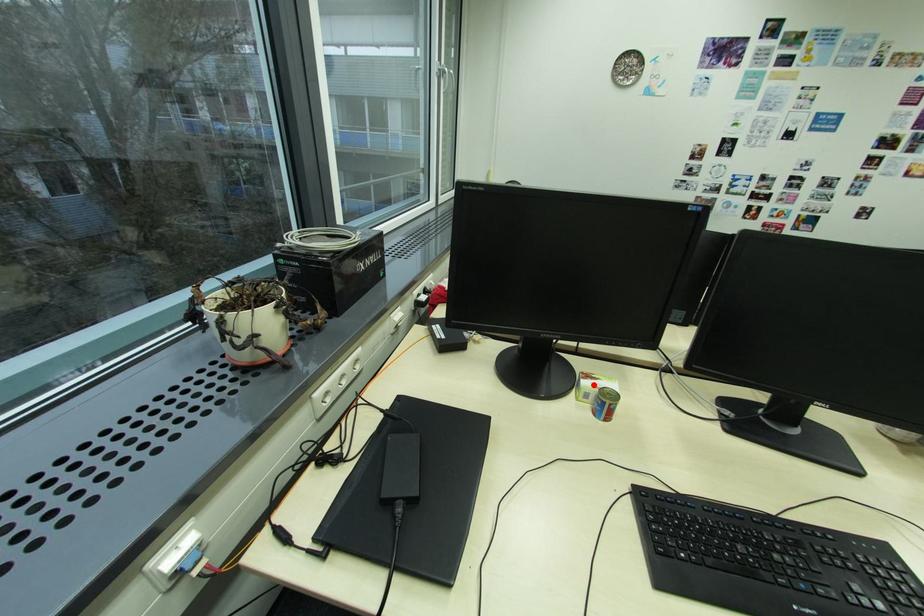
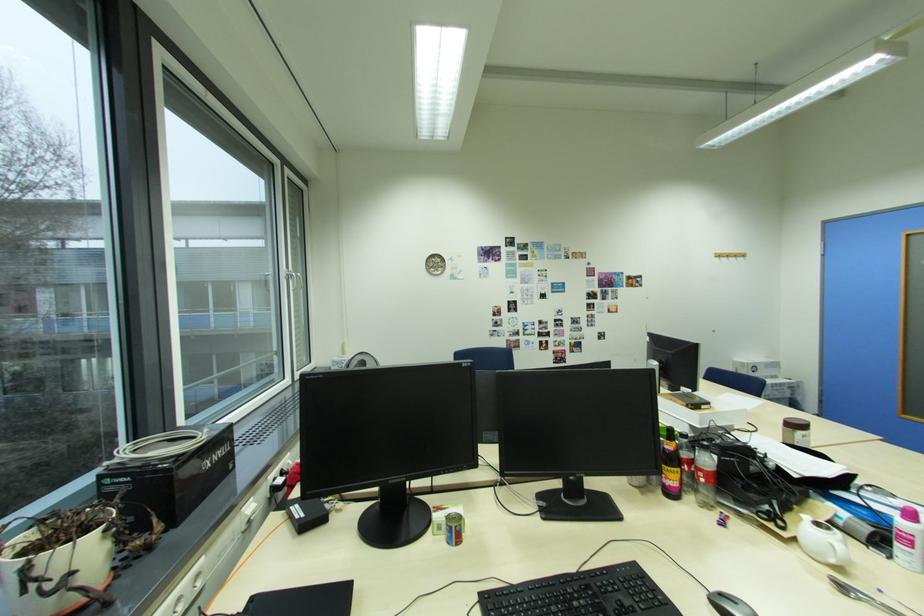
The point at the highlighted location is marked in the first image. Where is the corresponding point in the second image?

(444, 517)